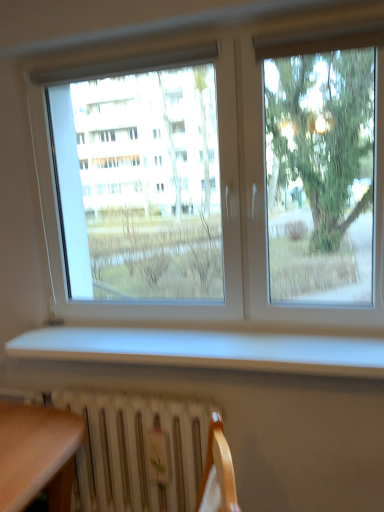
The image size is (384, 512). I want to click on vacant space situated above white matte window sill at lower center (from a real-world perspective), so click(164, 334).